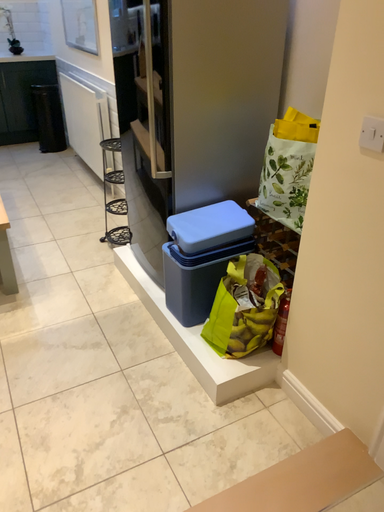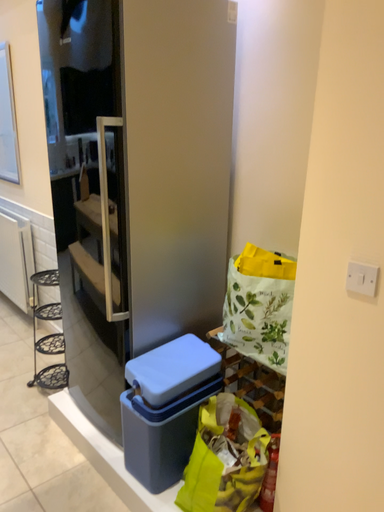
Question: How did the camera likely rotate when shooting the video?

Choices:
 (A) rotated left
 (B) rotated right

Answer: (B)